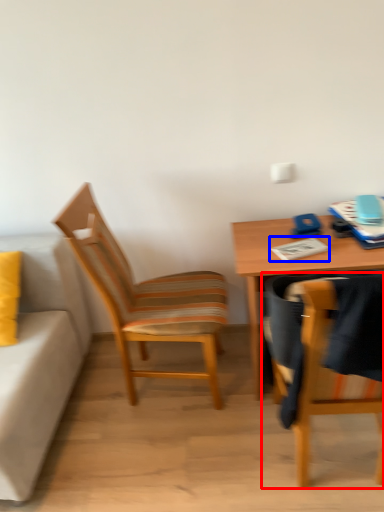
Question: Which of the following is the farthest to the observer, chair (highlighted by a red box) or notepad (highlighted by a blue box)?

Choices:
 (A) chair
 (B) notepad

Answer: (B)